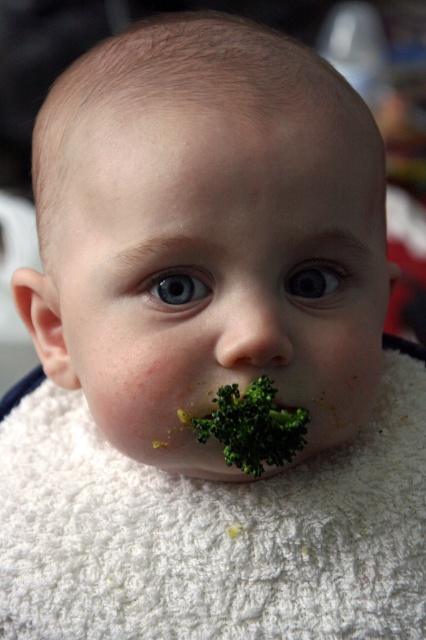
Between white fluffy blanket at center and green textured broccoli at mouth, which one appears on the left side from the viewer's perspective?

white fluffy blanket at center

Who is shorter, white fluffy blanket at center or green textured broccoli at mouth?

green textured broccoli at mouth

Does point (201, 484) come closer to viewer compared to point (287, 440)?

No, it is behind (287, 440).

Locate an element on the screen. white fluffy blanket at center is located at coordinates (213, 532).

Is blue glossy eye at center further to camera compared to green leafy vegetable at lower center?

Yes, blue glossy eye at center is behind green leafy vegetable at lower center.

Find the location of a particular element. blue glossy eye at center is located at coordinates (316, 280).

From the picture: Is white fluffy blanket at center positioned in front of blue glossy eye at center?

No, white fluffy blanket at center is further to the viewer.

Between point (377, 611) and point (331, 272), which one is positioned in front?

Point (331, 272) is in front.

The height and width of the screenshot is (640, 426). In order to click on white fluffy blanket at center in this screenshot , I will do `click(213, 532)`.